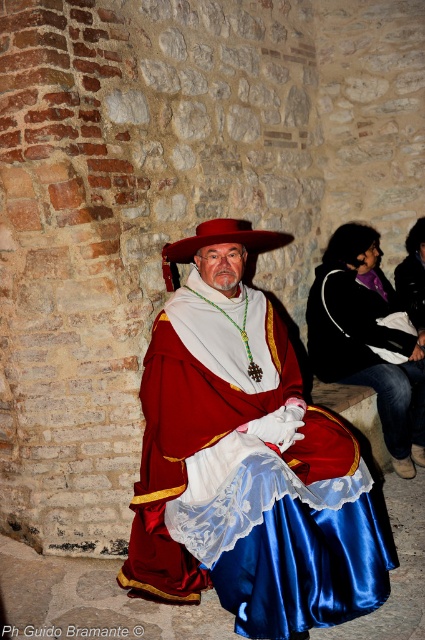
You are a photographer trying to capture the perfect shot of the person in the scene. You notice a point marked at coordinates (246, 461). Where is this point located in relation to the person?

The point at (246, 461) marks the location of the satin dress at center.

You are a costume designer preparing for a play. You have two items from the image to place on a mannequin. The satin dress at center and the matte red hat at center. Given their sizes, which item should you place first to ensure proper positioning?

The satin dress at center is larger in size than the matte red hat at center, so you should place the satin dress at center first to ensure proper positioning.

Based on the photo, you are a photographer standing at a distance of 10 feet from the stone wall. You want to take a closeup shot of the satin dress at center. Can you move closer to the dress to achieve the desired shot without stepping beyond the wall?

The satin dress at center is 8.76 feet away from the camera. Since you are currently 10 feet away from the stone wall, moving closer by 1.24 feet would allow you to reach the dress without exceeding the wall distance. Therefore, you can move closer to the satin dress at center to take the closeup shot.